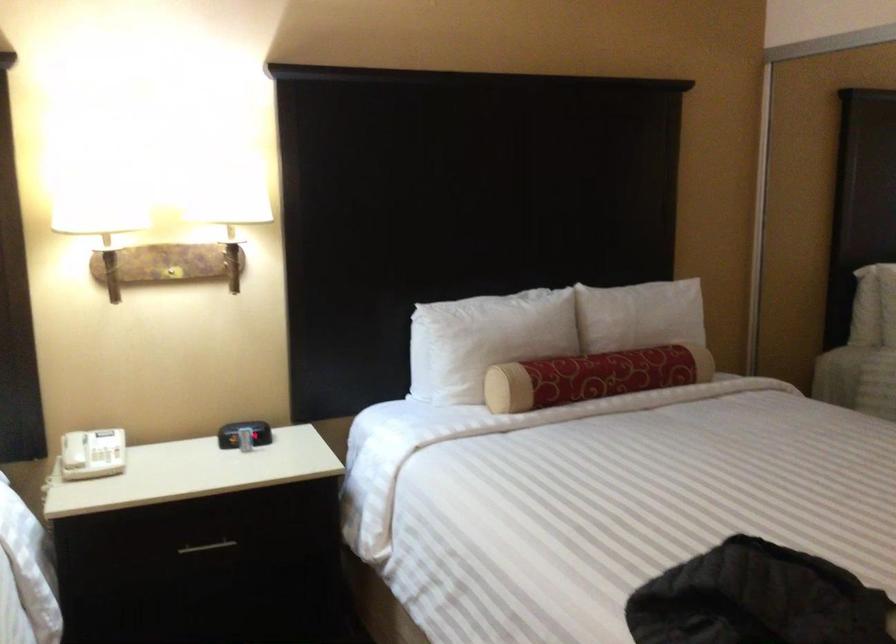
Which object does [592,377] point to?

It refers to a red bolster pillow.